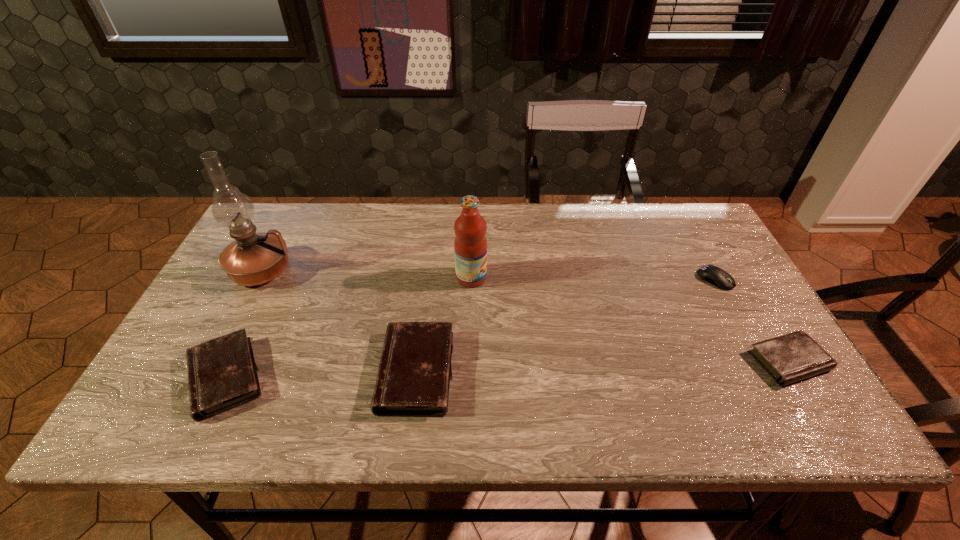
Where is `vacant region that satisfies the following two spatial constraints: 1. on the back side of the shortest diary; 2. on the front label of the fifth shortest object`? This screenshot has height=540, width=960. vacant region that satisfies the following two spatial constraints: 1. on the back side of the shortest diary; 2. on the front label of the fifth shortest object is located at coordinates (738, 278).

Image resolution: width=960 pixels, height=540 pixels. Identify the location of free spot that satisfies the following two spatial constraints: 1. on the front side of the second diary from left to right; 2. on the right side of the oil lamp. (209, 372).

Where is `vacant space that satisfies the following two spatial constraints: 1. on the front label of the computer equipment; 2. on the right side of the second tallest object`? The height and width of the screenshot is (540, 960). vacant space that satisfies the following two spatial constraints: 1. on the front label of the computer equipment; 2. on the right side of the second tallest object is located at coordinates (471, 280).

Where is `free space that satisfies the following two spatial constraints: 1. on the front label of the second tallest object; 2. on the front side of the leftmost diary`? This screenshot has width=960, height=540. free space that satisfies the following two spatial constraints: 1. on the front label of the second tallest object; 2. on the front side of the leftmost diary is located at coordinates (469, 377).

You are a GUI agent. You are given a task and a screenshot of the screen. Output one action in this format:
    pyautogui.click(x=<x>, y=<y>)
    Task: Click on the free space in the image that satisfies the following two spatial constraints: 1. on the front label of the computer equipment; 2. on the right side of the second tallest object
    The height and width of the screenshot is (540, 960).
    Given the screenshot: What is the action you would take?
    pyautogui.click(x=471, y=280)

The width and height of the screenshot is (960, 540). I want to click on free space that satisfies the following two spatial constraints: 1. on the front label of the fifth shortest object; 2. on the back side of the computer equipment, so click(471, 280).

This screenshot has width=960, height=540. Identify the location of blank area in the image that satisfies the following two spatial constraints: 1. on the front label of the fifth shortest object; 2. on the right side of the shortest diary. (469, 361).